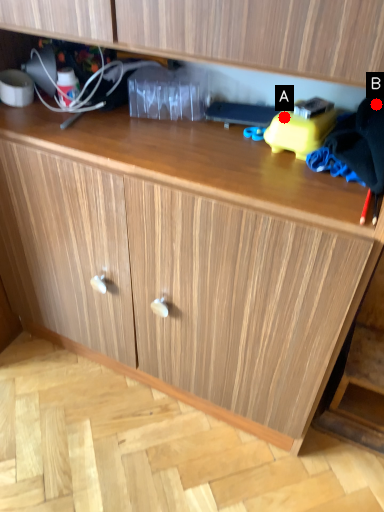
Question: Two points are circled on the image, labeled by A and B beside each circle. Among these points, which one is farthest from the camera?

Choices:
 (A) A is further
 (B) B is further

Answer: (A)